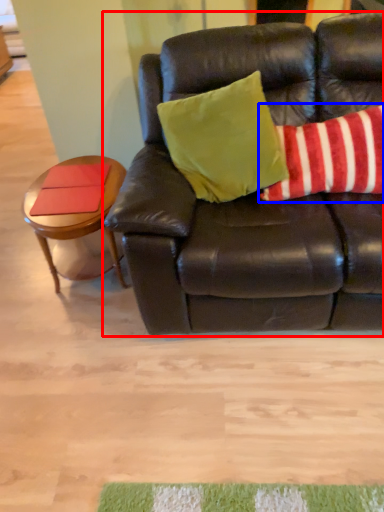
Question: Which object appears closest to the camera in this image, studio couch (highlighted by a red box) or pillow (highlighted by a blue box)?

Choices:
 (A) studio couch
 (B) pillow

Answer: (A)